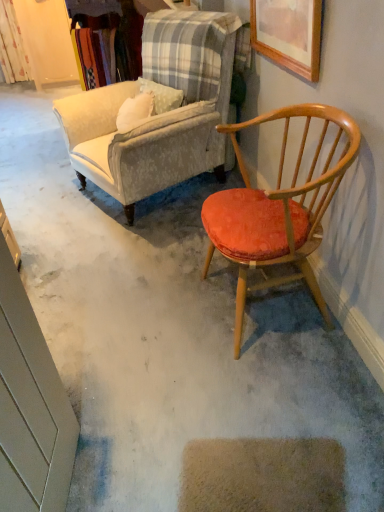
Question: Can you confirm if floral fabric curtain at upper left is thinner than velvet beige armchair at upper left, the first chair when ordered from back to front?

Choices:
 (A) yes
 (B) no

Answer: (A)

Question: From a real-world perspective, is floral fabric curtain at upper left on velvet beige armchair at upper left, which is the 2th chair from front to back?

Choices:
 (A) yes
 (B) no

Answer: (B)

Question: From the image's perspective, does floral fabric curtain at upper left appear higher than velvet beige armchair at upper left, which is the 2th chair from front to back?

Choices:
 (A) no
 (B) yes

Answer: (B)

Question: Is floral fabric curtain at upper left smaller than velvet beige armchair at upper left, the first chair when ordered from back to front?

Choices:
 (A) yes
 (B) no

Answer: (A)

Question: Does floral fabric curtain at upper left appear on the left side of velvet beige armchair at upper left, the first chair when ordered from back to front?

Choices:
 (A) no
 (B) yes

Answer: (B)

Question: Looking at the image, does velvet beige armchair at upper left, the first chair when ordered from back to front, seem bigger or smaller compared to wooden armchair with orange cushion at right, positioned as the 1th chair in front-to-back order?

Choices:
 (A) big
 (B) small

Answer: (A)

Question: From a real-world perspective, is velvet beige armchair at upper left, which is the 2th chair from front to back, positioned above or below wooden armchair with orange cushion at right, placed as the second chair when sorted from back to front?

Choices:
 (A) above
 (B) below

Answer: (A)

Question: Relative to wooden armchair with orange cushion at right, placed as the second chair when sorted from back to front, is velvet beige armchair at upper left, the first chair when ordered from back to front, in front or behind?

Choices:
 (A) behind
 (B) front

Answer: (A)

Question: Considering the relative positions of velvet beige armchair at upper left, the first chair when ordered from back to front, and wooden armchair with orange cushion at right, positioned as the 1th chair in front-to-back order, in the image provided, is velvet beige armchair at upper left, the first chair when ordered from back to front, to the left or to the right of wooden armchair with orange cushion at right, positioned as the 1th chair in front-to-back order,?

Choices:
 (A) left
 (B) right

Answer: (A)

Question: Is wooden picture frame at upper right inside the boundaries of wooden armchair with orange cushion at right, placed as the second chair when sorted from back to front, or outside?

Choices:
 (A) outside
 (B) inside

Answer: (A)

Question: Is wooden picture frame at upper right bigger or smaller than wooden armchair with orange cushion at right, placed as the second chair when sorted from back to front?

Choices:
 (A) small
 (B) big

Answer: (A)

Question: Considering their positions, is wooden picture frame at upper right located in front of or behind wooden armchair with orange cushion at right, positioned as the 1th chair in front-to-back order?

Choices:
 (A) front
 (B) behind

Answer: (B)

Question: In terms of width, does wooden picture frame at upper right look wider or thinner when compared to wooden armchair with orange cushion at right, positioned as the 1th chair in front-to-back order?

Choices:
 (A) wide
 (B) thin

Answer: (B)

Question: From their relative heights in the image, would you say wooden armchair with orange cushion at right, placed as the second chair when sorted from back to front, is taller or shorter than velvet beige armchair at upper left, the first chair when ordered from back to front?

Choices:
 (A) short
 (B) tall

Answer: (A)

Question: From a real-world perspective, relative to velvet beige armchair at upper left, which is the 2th chair from front to back, is wooden armchair with orange cushion at right, placed as the second chair when sorted from back to front, vertically above or below?

Choices:
 (A) above
 (B) below

Answer: (B)